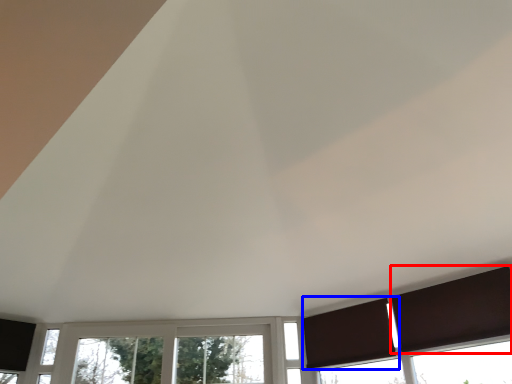
Question: Which point is closer to the camera, curtain (highlighted by a red box) or curtain (highlighted by a blue box)?

Choices:
 (A) curtain
 (B) curtain

Answer: (A)